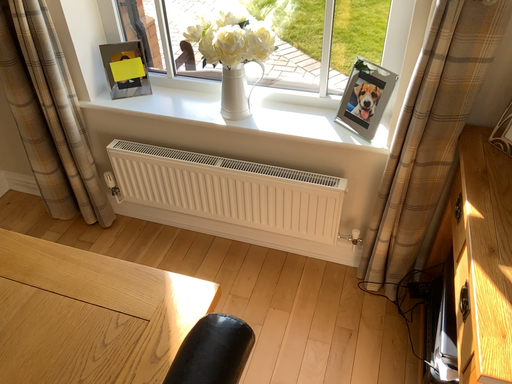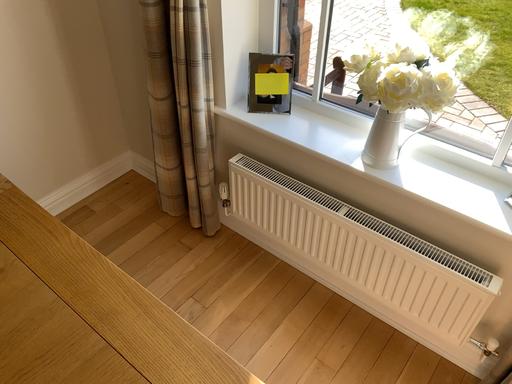
Question: How did the camera likely rotate when shooting the video?

Choices:
 (A) rotated right
 (B) rotated left

Answer: (B)